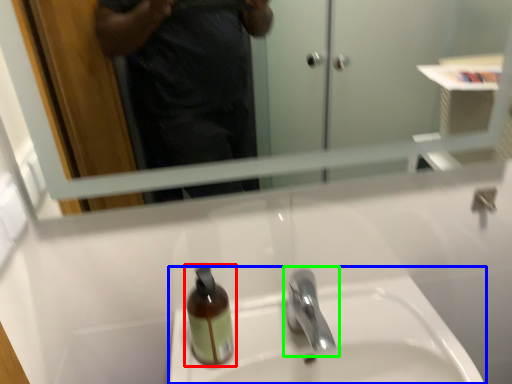
Question: Based on their relative distances, which object is farther from bottle (highlighted by a red box)? Choose from sink (highlighted by a blue box) and tap (highlighted by a green box).

Choices:
 (A) sink
 (B) tap

Answer: (A)